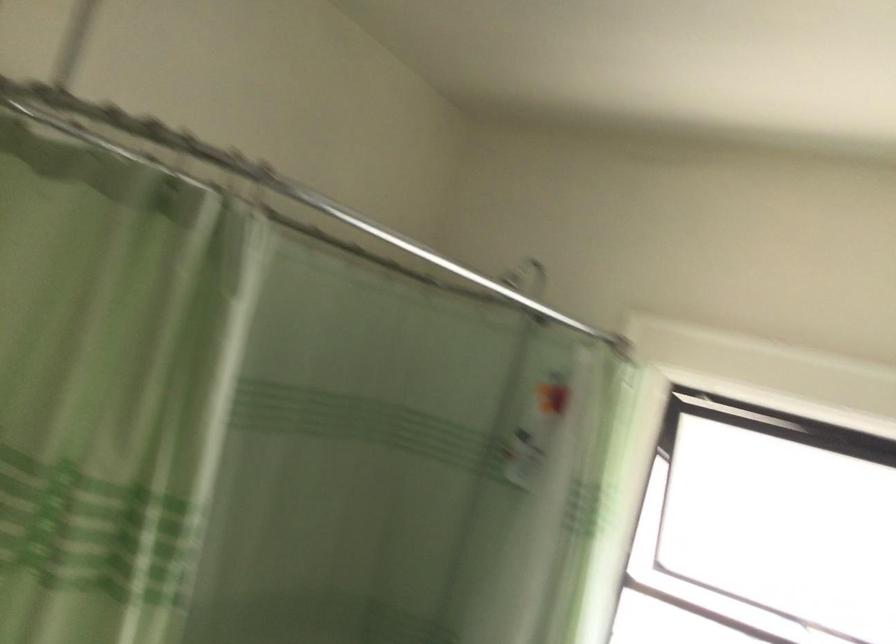
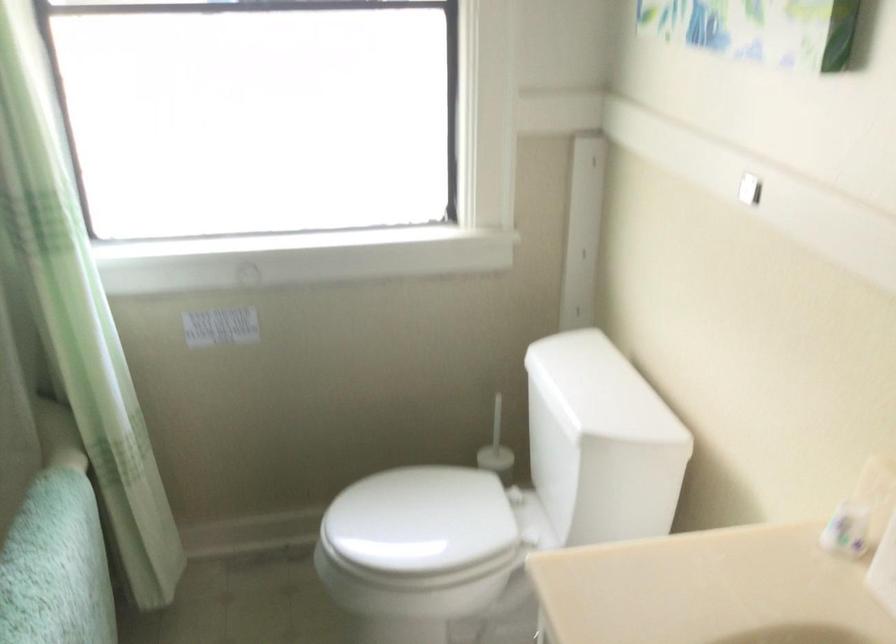
Looking at this image, based on the continuous images, in which direction is the camera rotating?

The camera's rotation is toward right-down.